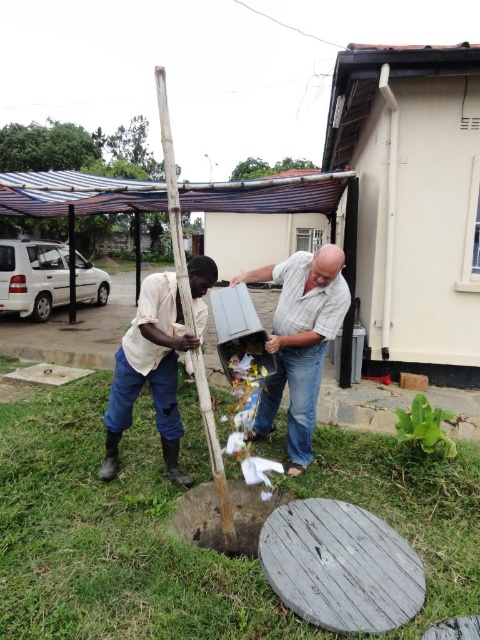
Is matte gray plastic container at center in front of dark brown wood at center?

No.

Between matte gray plastic container at center and dark brown wood at center, which one appears on the right side from the viewer's perspective?

matte gray plastic container at center

Is point (319, 280) behind point (232, 515)?

That is False.

Image resolution: width=480 pixels, height=640 pixels. I want to click on matte gray plastic container at center, so [300, 340].

Can you confirm if blue striped canopy at upper left is positioned to the left of wooden pole at center?

Indeed, blue striped canopy at upper left is positioned on the left side of wooden pole at center.

Can you confirm if blue striped canopy at upper left is wider than wooden pole at center?

Correct, the width of blue striped canopy at upper left exceeds that of wooden pole at center.

What do you see at coordinates (79, 148) in the screenshot? This screenshot has width=480, height=640. I see `blue striped canopy at upper left` at bounding box center [79, 148].

Where is `blue striped canopy at upper left`? The width and height of the screenshot is (480, 640). blue striped canopy at upper left is located at coordinates (79, 148).

Is dark brown wood at center to the left of wooden pole at center from the viewer's perspective?

Incorrect, dark brown wood at center is not on the left side of wooden pole at center.

Does dark brown wood at center have a larger size compared to wooden pole at center?

No.

At what (x,y) coordinates should I click in order to perform the action: click on dark brown wood at center. Please return your answer as a coordinate pair (x, y). Looking at the image, I should click on (224, 516).